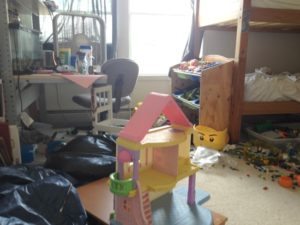
Image resolution: width=300 pixels, height=225 pixels. What are the coordinates of `floor` in the screenshot? It's located at tap(242, 201).